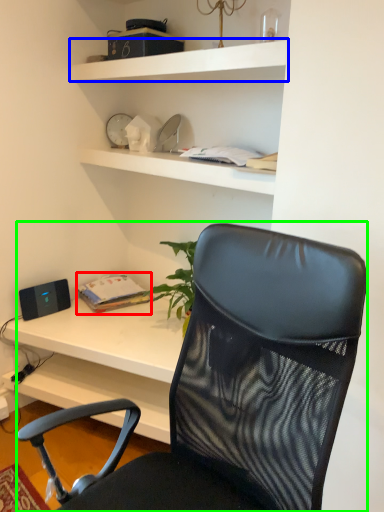
Question: Which object is the farthest from book (highlighted by a red box)? Choose among these: shelf (highlighted by a blue box) or chair (highlighted by a green box).

Choices:
 (A) shelf
 (B) chair

Answer: (B)